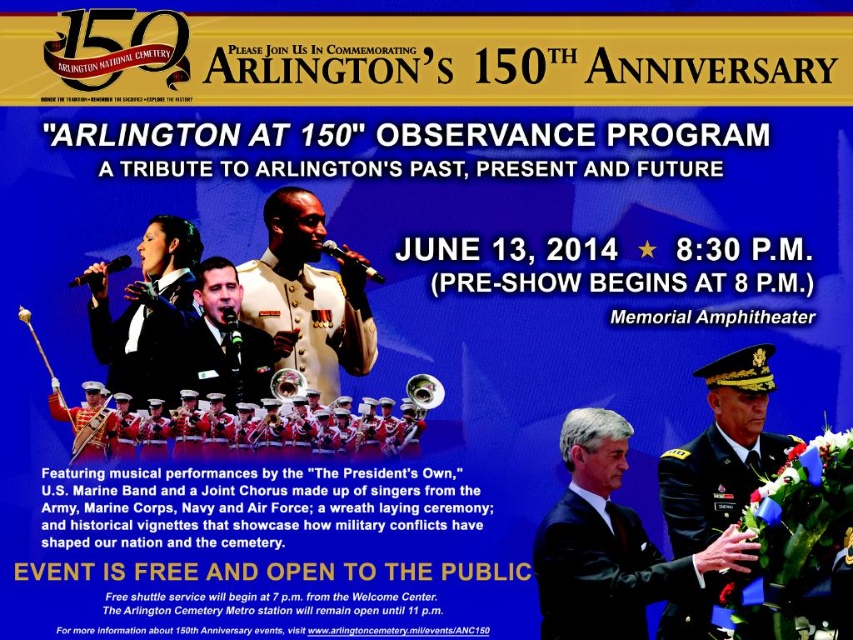
Between point (189, 317) and point (94, 273), which one is positioned in front?

Positioned in front is point (94, 273).

Which is in front, point (97, 298) or point (93, 273)?

Positioned in front is point (93, 273).

At what (x,y) coordinates should I click in order to perform the action: click on shiny black suit at left. Please return your answer as a coordinate pair (x, y). This screenshot has width=853, height=640. Looking at the image, I should click on (146, 339).

Which is more to the right, black uniform at center or brass/polished metal tuba at center?

From the viewer's perspective, black uniform at center appears more on the right side.

Is black uniform at center positioned behind brass/polished metal tuba at center?

No.

Does point (560, 563) come in front of point (416, 424)?

Yes.

You are a GUI agent. You are given a task and a screenshot of the screen. Output one action in this format:
    pyautogui.click(x=<x>, y=<y>)
    Task: Click on the black uniform at center
    Image resolution: width=853 pixels, height=640 pixels.
    Given the screenshot: What is the action you would take?
    pyautogui.click(x=611, y=544)

Which is above, shiny black uniform at center or brass/polished metal tuba at center?

shiny black uniform at center

Can you confirm if shiny black uniform at center is shorter than brass/polished metal tuba at center?

No, shiny black uniform at center is not shorter than brass/polished metal tuba at center.

The width and height of the screenshot is (853, 640). Describe the element at coordinates (228, 339) in the screenshot. I see `shiny black uniform at center` at that location.

Locate an element on the screen. shiny black uniform at center is located at coordinates (228, 339).